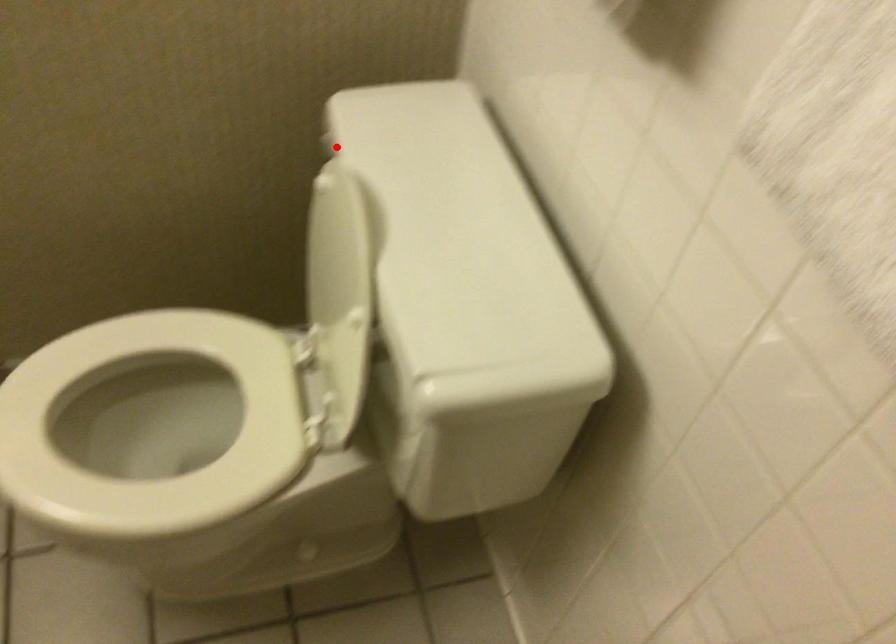
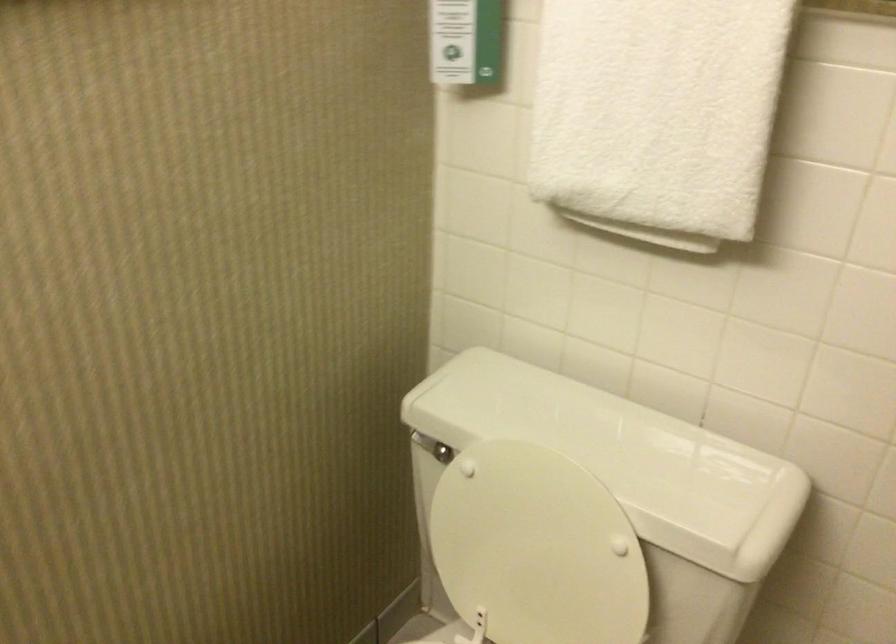
Question: I am providing you with two images of the same scene from different viewpoints. Given a red point in image1, look at the same physical point in image2. Is it:

Choices:
 (A) Closer to the viewpoint
 (B) Farther from the viewpoint

Answer: (B)